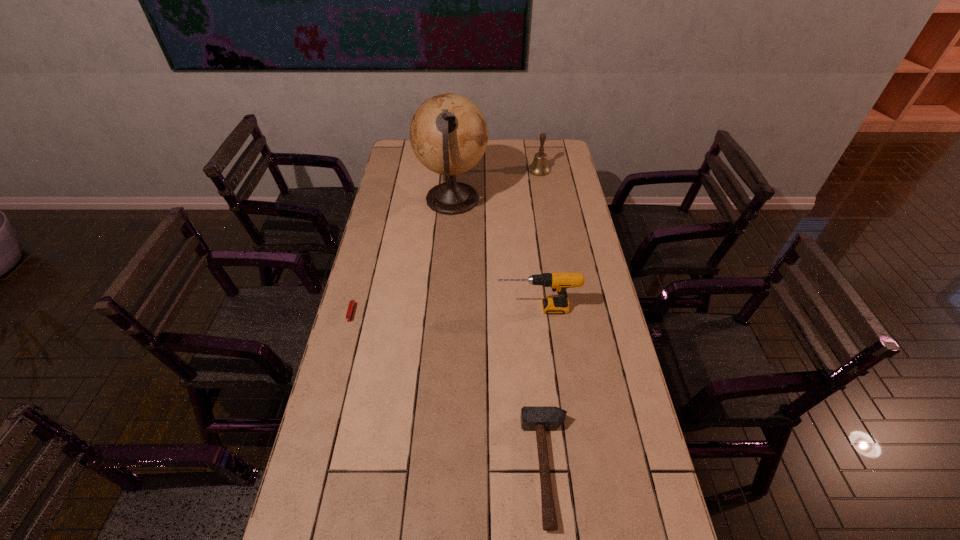
Find the location of `free spot that satisfies the following two spatial constraints: 1. on the handle side of the third tallest object; 2. on the front-facing side of the stapler`. free spot that satisfies the following two spatial constraints: 1. on the handle side of the third tallest object; 2. on the front-facing side of the stapler is located at coordinates (538, 313).

Identify the location of vacant region that satisfies the following two spatial constraints: 1. on the handle side of the third shortest object; 2. on the front-facing side of the shortest object. The width and height of the screenshot is (960, 540). (538, 313).

The width and height of the screenshot is (960, 540). Identify the location of vacant position in the image that satisfies the following two spatial constraints: 1. on the handle side of the drill; 2. on the front-facing side of the leftmost object. (538, 313).

Identify the location of vacant region that satisfies the following two spatial constraints: 1. on the handle side of the third shortest object; 2. on the front-facing side of the shortest object. (538, 313).